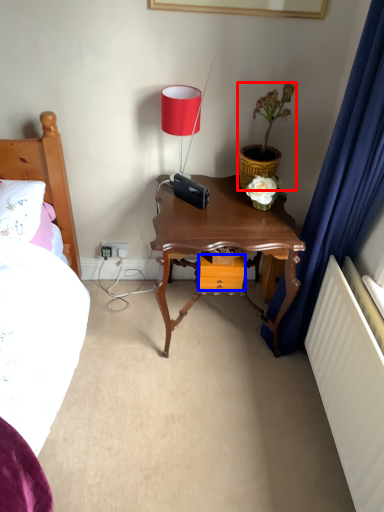
Question: Which point is further to the camera, houseplant (highlighted by a red box) or drawer (highlighted by a blue box)?

Choices:
 (A) houseplant
 (B) drawer

Answer: (B)